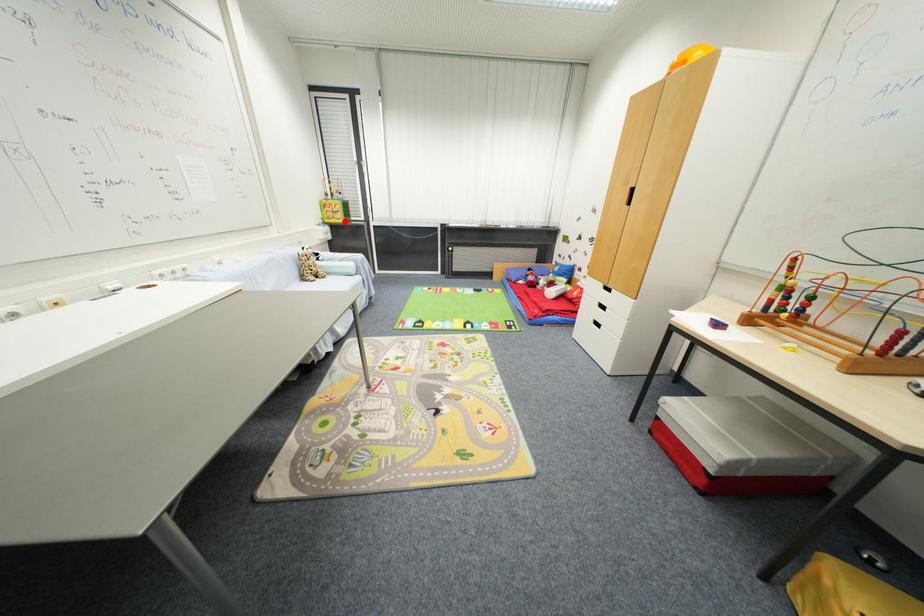
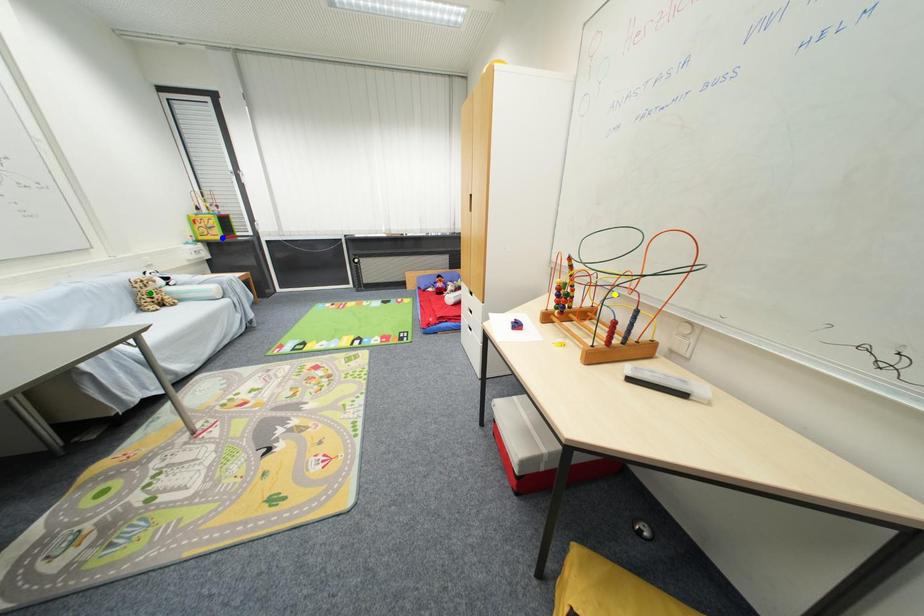
Question: I am providing you with two images of the same scene from different viewpoints. A red point is marked on the first image. You are given multiple points on the second image. Which mark in image 2 goes with the point in image 1?

Choices:
 (A) yellow point
 (B) green point
 (C) blue point

Answer: (C)